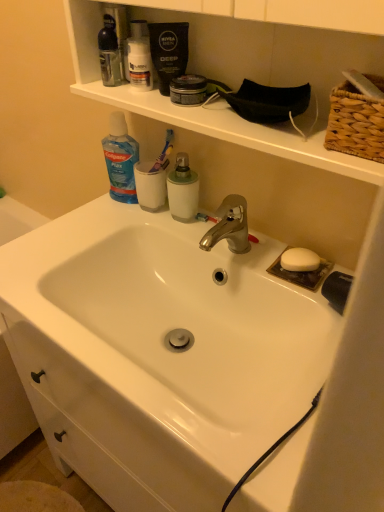
Where is `free space in front of blue translucent liquid at upper left`? The width and height of the screenshot is (384, 512). free space in front of blue translucent liquid at upper left is located at coordinates (102, 227).